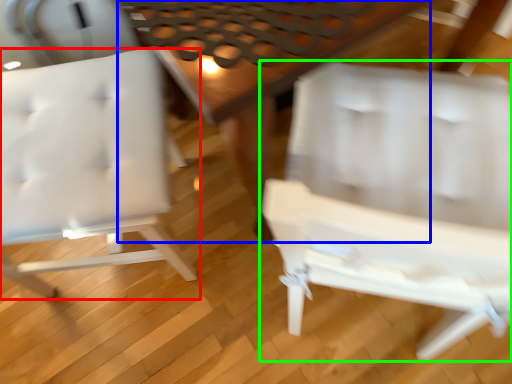
Question: Estimate the real-world distances between objects in this image. Which object is farther from chair (highlighted by a red box), table (highlighted by a blue box) or chair (highlighted by a green box)?

Choices:
 (A) table
 (B) chair

Answer: (B)